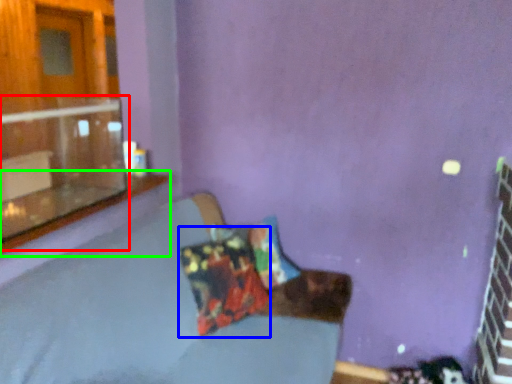
Question: Which object is the closest to the window (highlighted by a red box)? Choose among these: pillow (highlighted by a blue box) or window sill (highlighted by a green box).

Choices:
 (A) pillow
 (B) window sill

Answer: (B)